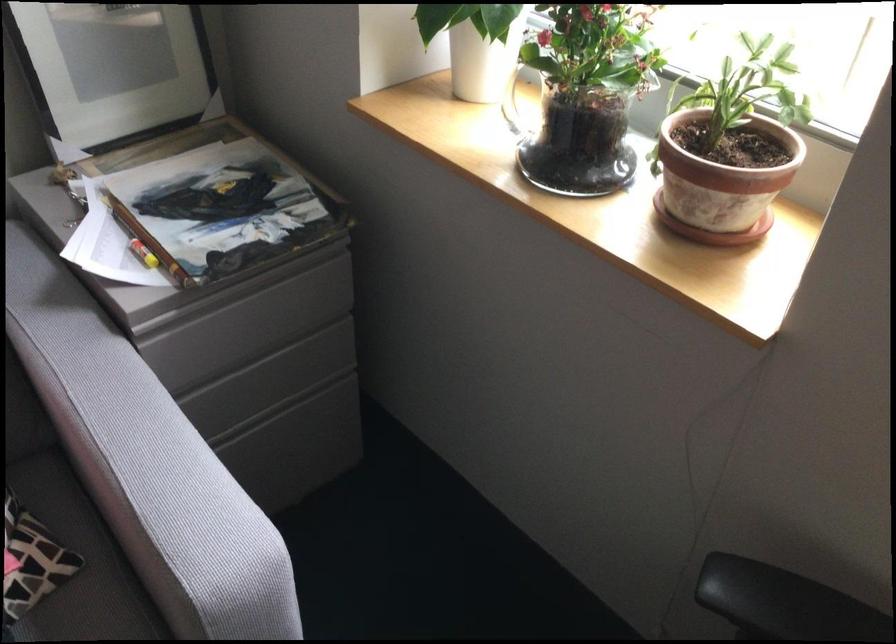
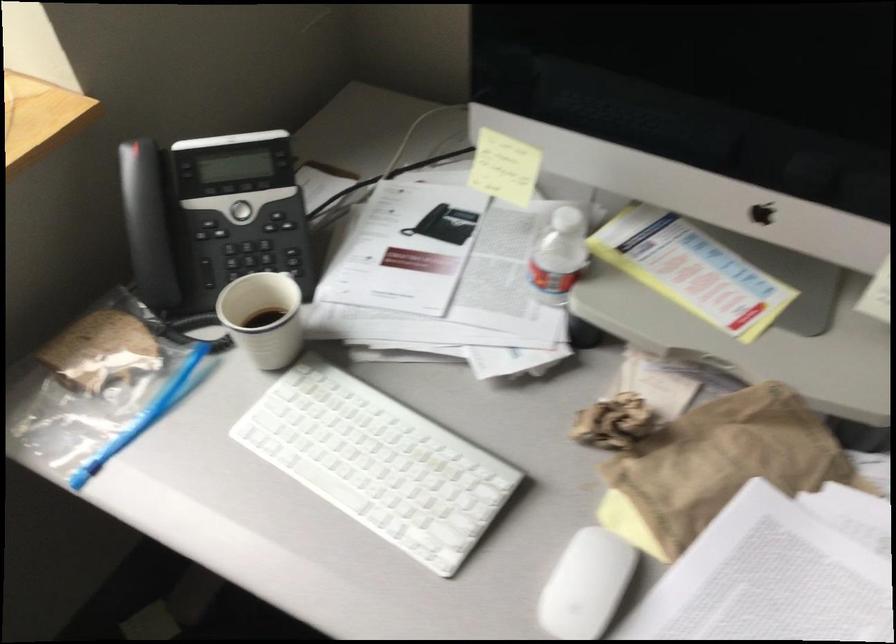
How did the camera likely rotate?

The camera's rotation is toward right-down.